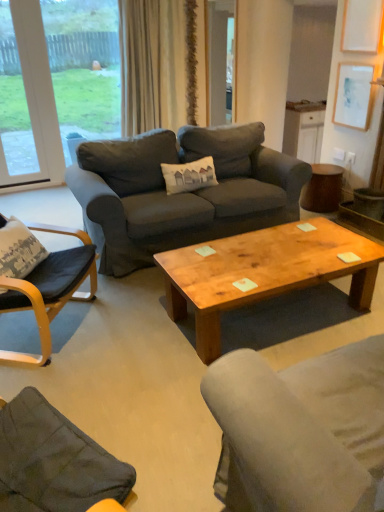
Question: Does dark gray fabric couch at center turn towards brown wooden side table at right?

Choices:
 (A) yes
 (B) no

Answer: (B)

Question: Is brown wooden side table at right located within dark gray fabric couch at center?

Choices:
 (A) no
 (B) yes

Answer: (A)

Question: Does dark gray fabric couch at center have a lesser width compared to brown wooden side table at right?

Choices:
 (A) yes
 (B) no

Answer: (B)

Question: Can you confirm if dark gray fabric couch at center is smaller than brown wooden side table at right?

Choices:
 (A) no
 (B) yes

Answer: (A)

Question: Is dark gray fabric couch at center behind brown wooden side table at right?

Choices:
 (A) no
 (B) yes

Answer: (A)

Question: From a real-world perspective, is dark gray fabric couch at center over brown wooden side table at right?

Choices:
 (A) no
 (B) yes

Answer: (B)

Question: Is white paper at upper right thinner than transparent glass window at upper left, arranged as the second window when viewed from the left?

Choices:
 (A) no
 (B) yes

Answer: (B)

Question: Is white paper at upper right turned away from transparent glass window at upper left, arranged as the second window when viewed from the left?

Choices:
 (A) yes
 (B) no

Answer: (B)

Question: Does white paper at upper right appear on the right side of transparent glass window at upper left, arranged as the second window when viewed from the left?

Choices:
 (A) no
 (B) yes

Answer: (B)

Question: From the image's perspective, is white paper at upper right above transparent glass window at upper left, which is the 1th window in right-to-left order?

Choices:
 (A) yes
 (B) no

Answer: (B)

Question: Would you say transparent glass window at upper left, arranged as the second window when viewed from the left, is part of white paper at upper right's contents?

Choices:
 (A) no
 (B) yes

Answer: (A)

Question: Can you confirm if white paper at upper right is bigger than transparent glass window at upper left, which is the 1th window in right-to-left order?

Choices:
 (A) yes
 (B) no

Answer: (B)

Question: Can you confirm if white paper at upper right is shorter than white plastic window at upper left, marked as the 2th window in a right-to-left arrangement?

Choices:
 (A) no
 (B) yes

Answer: (B)